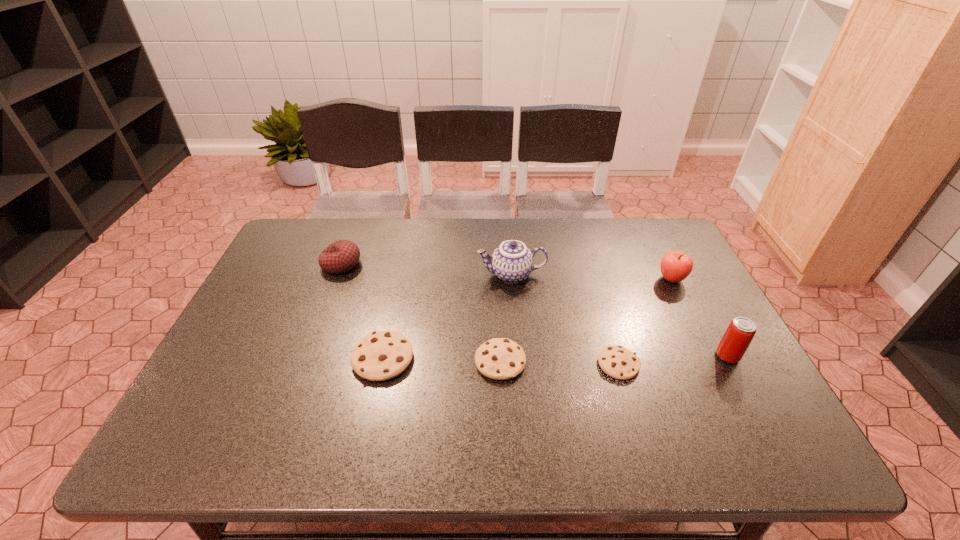
At what (x,y) coordinates should I click in order to perform the action: click on beer can. Please return your answer as a coordinate pair (x, y). The width and height of the screenshot is (960, 540). Looking at the image, I should click on (736, 339).

At what (x,y) coordinates should I click in order to perform the action: click on free spot located 0.110m on the right of the second object from left to right. Please return your answer as a coordinate pair (x, y). The image size is (960, 540). Looking at the image, I should click on (458, 358).

I want to click on free region located 0.300m on the left of the second shortest cookie, so click(x=352, y=361).

Locate an element on the screen. free space located 0.290m on the left of the rightmost cookie is located at coordinates (479, 364).

Image resolution: width=960 pixels, height=540 pixels. In order to click on vacant space located 0.230m from the spout of the chinaware in this screenshot , I will do `click(400, 274)`.

Locate an element on the screen. vacant position located from the spout of the chinaware is located at coordinates (444, 274).

Locate an element on the screen. The image size is (960, 540). vacant space located 0.110m from the spout of the chinaware is located at coordinates (441, 274).

The image size is (960, 540). I want to click on vacant space located on the left of the beanbag, so click(273, 264).

Locate an element on the screen. This screenshot has width=960, height=540. free space located on the front of the apple is located at coordinates (701, 339).

Locate an element on the screen. The image size is (960, 540). vacant area located 0.240m on the left of the beer can is located at coordinates coord(619,356).